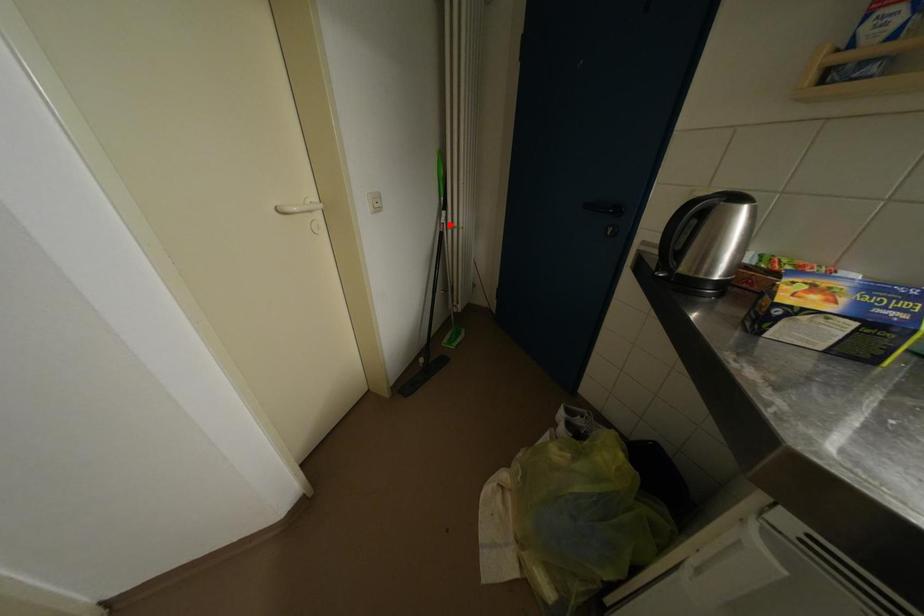
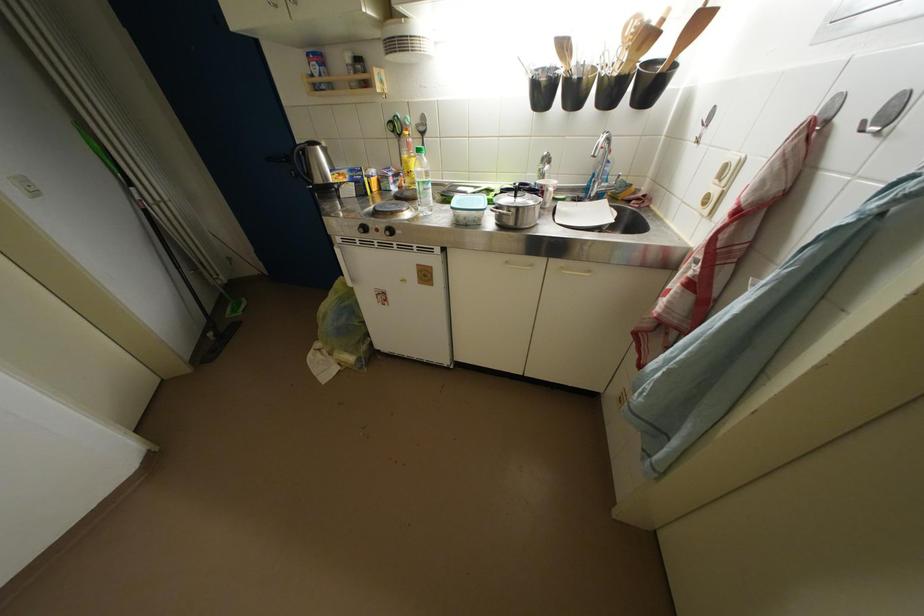
Find the pixel in the second image that matches the highlighted location in the first image.

(144, 201)